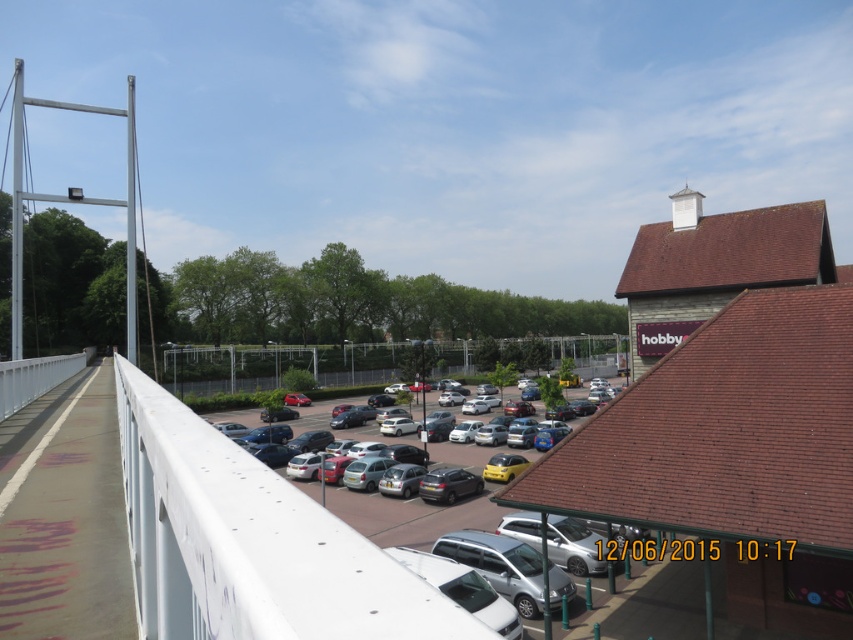
From the picture: You are a delivery person needing to park your 5.5 meter long truck between the silver metallic van at center and the silver metallic hatchback at center. Can you fit your truck in the space between them?

The distance between the silver metallic van at center and the silver metallic hatchback at center is 26.29 meters. Since your truck is only 5.5 meters long, there is more than enough space to park it between them.

You are standing on the pedestrian bridge and want to take a photo of the silver metallic hatchback at center and the satin silver car at center. Which one should you point your camera towards the left side to capture?

You should point your camera towards the left side to capture the silver metallic hatchback at center because it is positioned to the left of the satin silver car at center.